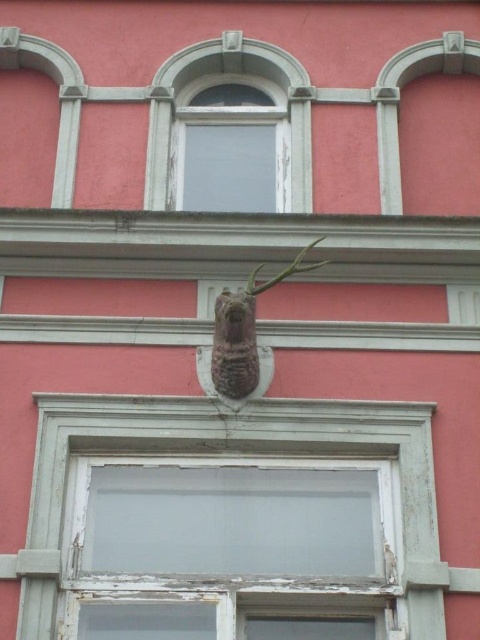
In the scene shown: Between rustic stone owl at center and green wood branch at center, which one appears on the right side from the viewer's perspective?

Positioned to the right is green wood branch at center.

Can you confirm if rustic stone owl at center is shorter than green wood branch at center?

No.

Which is in front, point (213, 380) or point (252, 288)?

Positioned in front is point (252, 288).

This screenshot has width=480, height=640. Identify the location of rustic stone owl at center. [x=235, y=346].

Which is in front, point (175, 406) or point (168, 61)?

Positioned in front is point (175, 406).

Who is taller, weathered wood window frame at center or matte glass window at upper center?

With more height is matte glass window at upper center.

This screenshot has width=480, height=640. What do you see at coordinates (254, 452) in the screenshot? I see `weathered wood window frame at center` at bounding box center [254, 452].

This screenshot has width=480, height=640. In order to click on weathered wood window frame at center in this screenshot , I will do `click(254, 452)`.

Is weathered wood window frame at center shorter than rustic stone owl at center?

In fact, weathered wood window frame at center may be taller than rustic stone owl at center.

Is weathered wood window frame at center smaller than rustic stone owl at center?

No.

Does point (82, 435) come closer to viewer compared to point (240, 337)?

Yes, it is in front of point (240, 337).

I want to click on weathered wood window frame at center, so click(x=254, y=452).